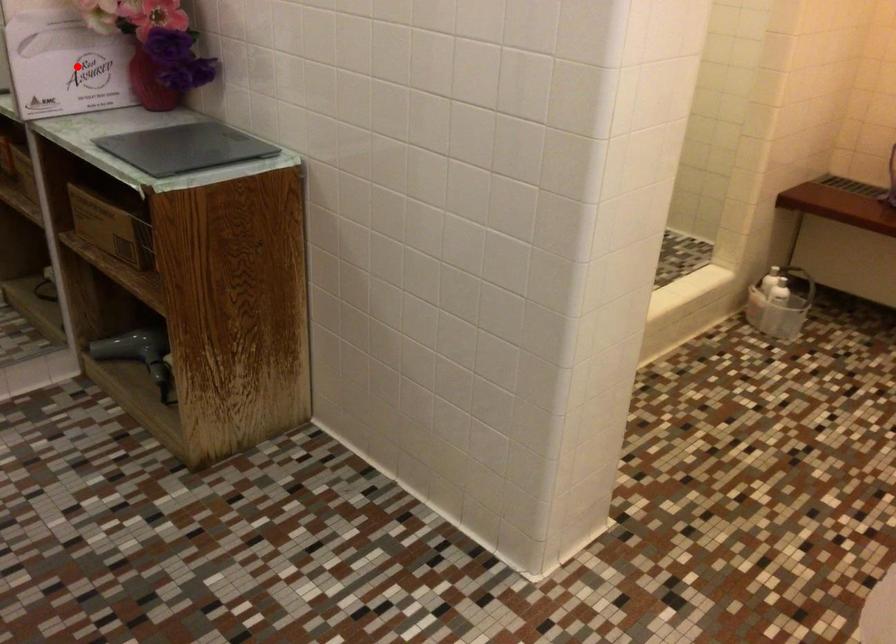
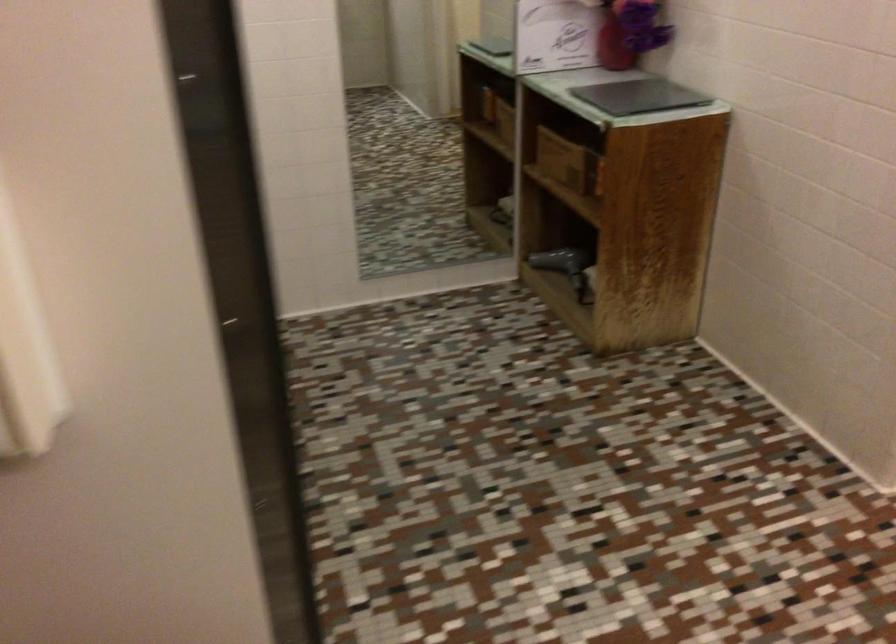
Question: I am providing you with two images of the same scene from different viewpoints. In image1, a red point is highlighted. Considering the same 3D point in image2, which of the following is correct?

Choices:
 (A) It is closer
 (B) It is farther

Answer: (B)